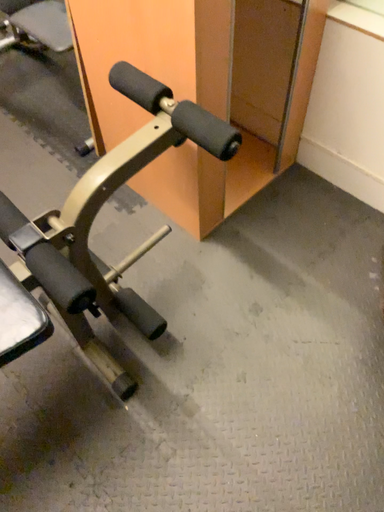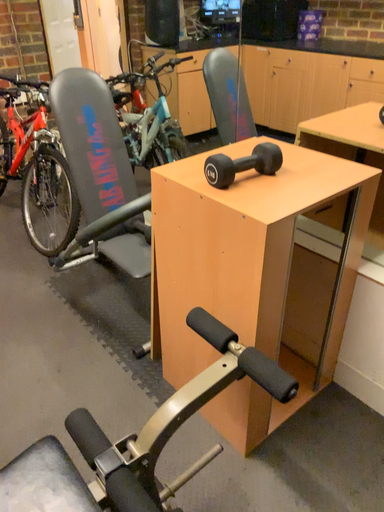
Question: Which way did the camera rotate in the video?

Choices:
 (A) rotated upward
 (B) rotated downward

Answer: (A)